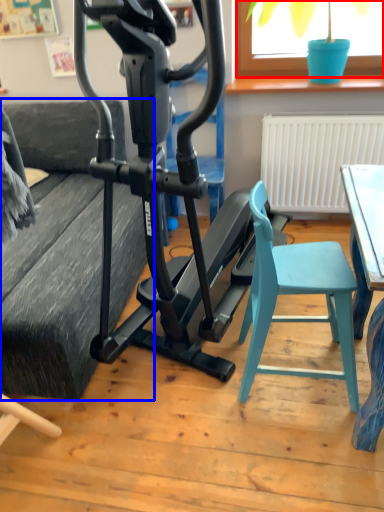
Question: Among these objects, which one is farthest to the camera, window screen (highlighted by a red box) or couch (highlighted by a blue box)?

Choices:
 (A) window screen
 (B) couch

Answer: (A)